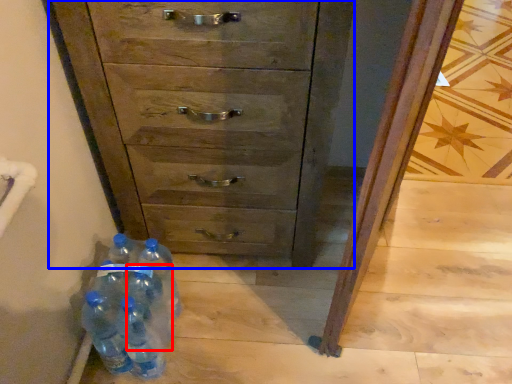
Question: Among these objects, which one is farthest to the camera, bottle (highlighted by a red box) or chest of drawers (highlighted by a blue box)?

Choices:
 (A) bottle
 (B) chest of drawers

Answer: (A)